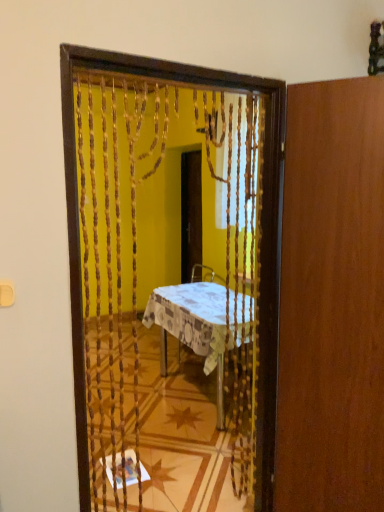
Question: From a real-world perspective, is patterned fabric table at center on top of wooden screen door at center?

Choices:
 (A) yes
 (B) no

Answer: (B)

Question: Is patterned fabric table at center shorter than wooden screen door at center?

Choices:
 (A) no
 (B) yes

Answer: (B)

Question: Are patterned fabric table at center and wooden screen door at center making contact?

Choices:
 (A) no
 (B) yes

Answer: (A)

Question: Is patterned fabric table at center facing away from wooden screen door at center?

Choices:
 (A) no
 (B) yes

Answer: (A)

Question: Is wooden screen door at center surrounded by patterned fabric table at center?

Choices:
 (A) no
 (B) yes

Answer: (A)

Question: Considering the positions of wooden door at right and wooden screen door at center in the image, is wooden door at right taller or shorter than wooden screen door at center?

Choices:
 (A) short
 (B) tall

Answer: (B)

Question: Visually, is wooden door at right positioned to the left or to the right of wooden screen door at center?

Choices:
 (A) left
 (B) right

Answer: (B)

Question: In terms of width, does wooden door at right look wider or thinner when compared to wooden screen door at center?

Choices:
 (A) thin
 (B) wide

Answer: (B)

Question: From a real-world perspective, is wooden door at right physically located above or below wooden screen door at center?

Choices:
 (A) below
 (B) above

Answer: (A)

Question: Is point (322, 323) positioned closer to the camera than point (114, 194)?

Choices:
 (A) closer
 (B) farther

Answer: (B)

Question: Is wooden door at right spatially inside wooden beaded curtain at center, or outside of it?

Choices:
 (A) inside
 (B) outside

Answer: (B)

Question: Would you say wooden door at right is to the left or to the right of wooden beaded curtain at center in the picture?

Choices:
 (A) left
 (B) right

Answer: (B)

Question: Considering the positions of wooden door at right and wooden beaded curtain at center in the image, is wooden door at right bigger or smaller than wooden beaded curtain at center?

Choices:
 (A) big
 (B) small

Answer: (A)

Question: Is wooden screen door at center taller or shorter than patterned fabric table at center?

Choices:
 (A) tall
 (B) short

Answer: (A)

Question: From a real-world perspective, is wooden screen door at center physically located above or below patterned fabric table at center?

Choices:
 (A) below
 (B) above

Answer: (B)